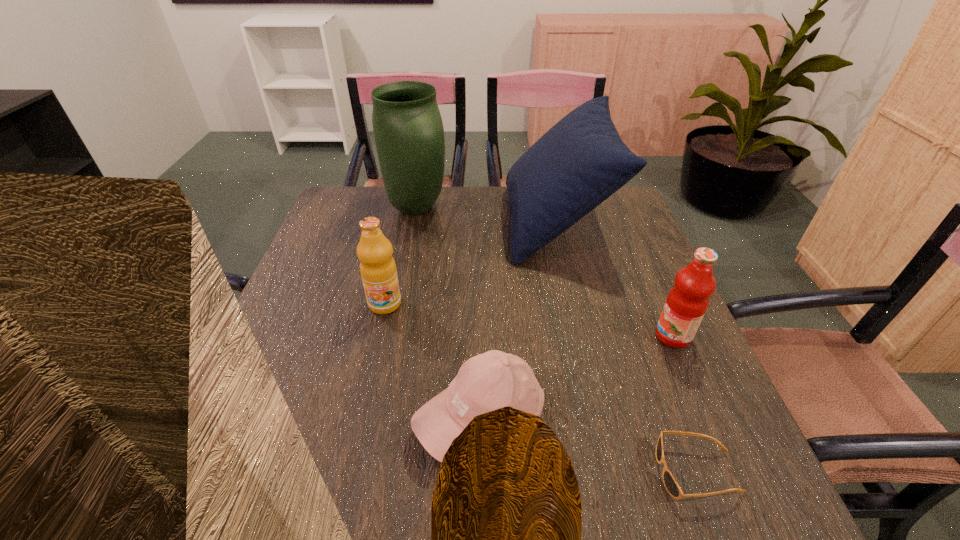
Locate an element on the screen. vacant space at the left edge of the desktop is located at coordinates (301, 352).

In the image, there is a desktop. Identify the location of blank space at the right edge. This screenshot has width=960, height=540. (603, 277).

What are the coordinates of `blank space at the far left corner of the desktop` in the screenshot? It's located at (380, 212).

This screenshot has height=540, width=960. In order to click on vacant space at the near left corner of the desktop in this screenshot , I will do `click(252, 522)`.

Identify the location of free space at the far right corner. (609, 200).

Where is `unoccupied area between the left fruit juice and the vase`? This screenshot has width=960, height=540. unoccupied area between the left fruit juice and the vase is located at coordinates (400, 256).

I want to click on vacant area that lies between the fifth tallest object and the left fruit juice, so click(x=433, y=361).

Identify the location of empty location between the shortest object and the second tallest object. (626, 347).

This screenshot has width=960, height=540. What are the coordinates of `vacant point located between the shortest object and the vase` in the screenshot? It's located at (557, 340).

The image size is (960, 540). I want to click on blank region between the right fruit juice and the fifth shortest object, so click(614, 279).